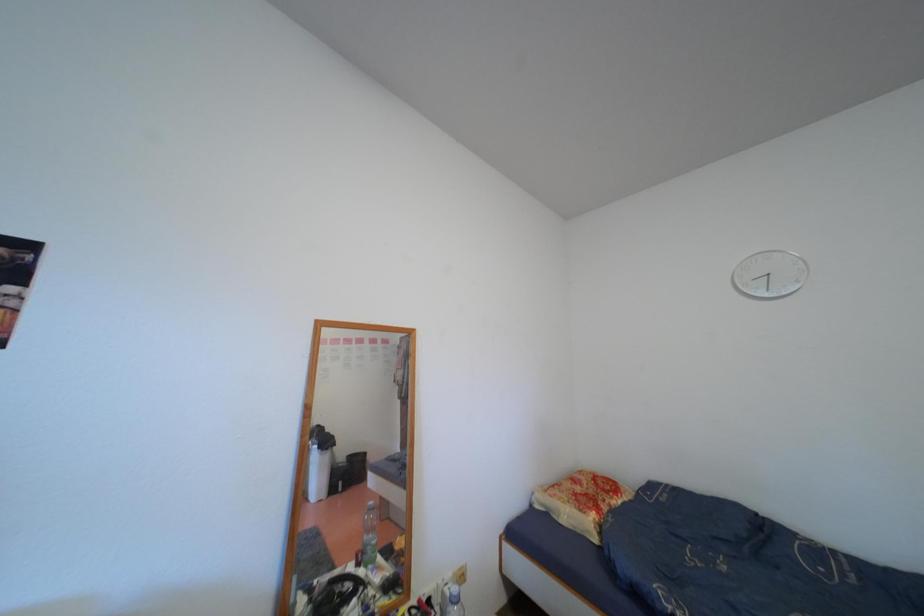
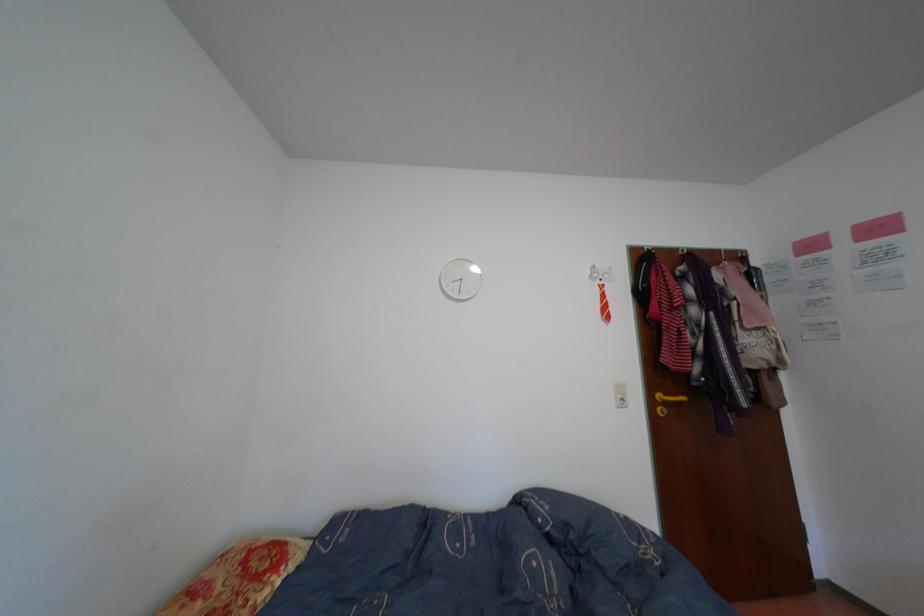
Question: The camera is either moving clockwise (left) or counter-clockwise (right) around the object. The first image is from the beginning of the video and the second image is from the end. Is the camera moving left or right when shooting the video?

Choices:
 (A) Left
 (B) Right

Answer: (A)